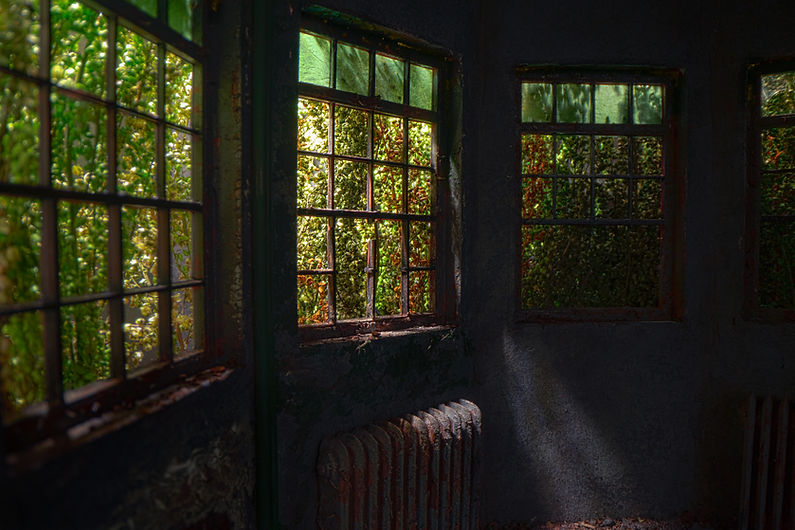
This screenshot has width=795, height=530. Find the location of `window frames`. window frames is located at coordinates (210, 270), (156, 255), (111, 252), (105, 194), (330, 212), (374, 214), (419, 214).